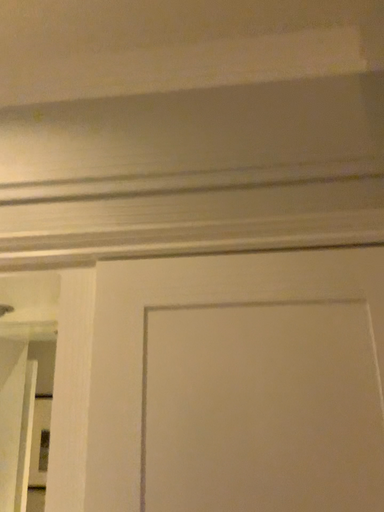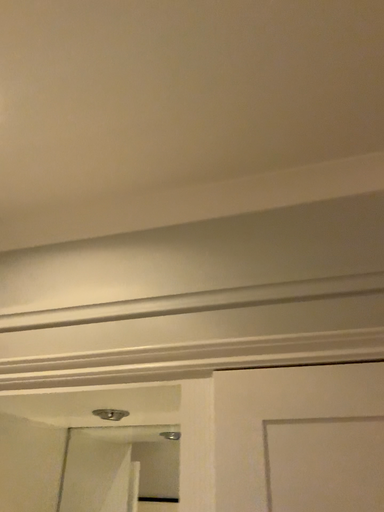
Question: How did the camera likely rotate when shooting the video?

Choices:
 (A) rotated upward
 (B) rotated downward

Answer: (A)